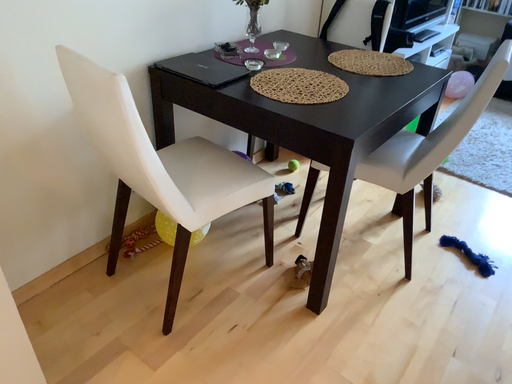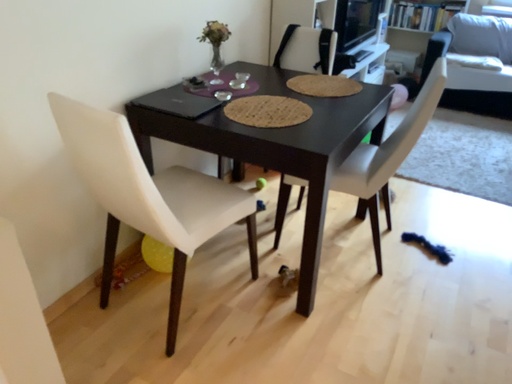
Question: How did the camera likely rotate when shooting the video?

Choices:
 (A) rotated left
 (B) rotated right

Answer: (B)